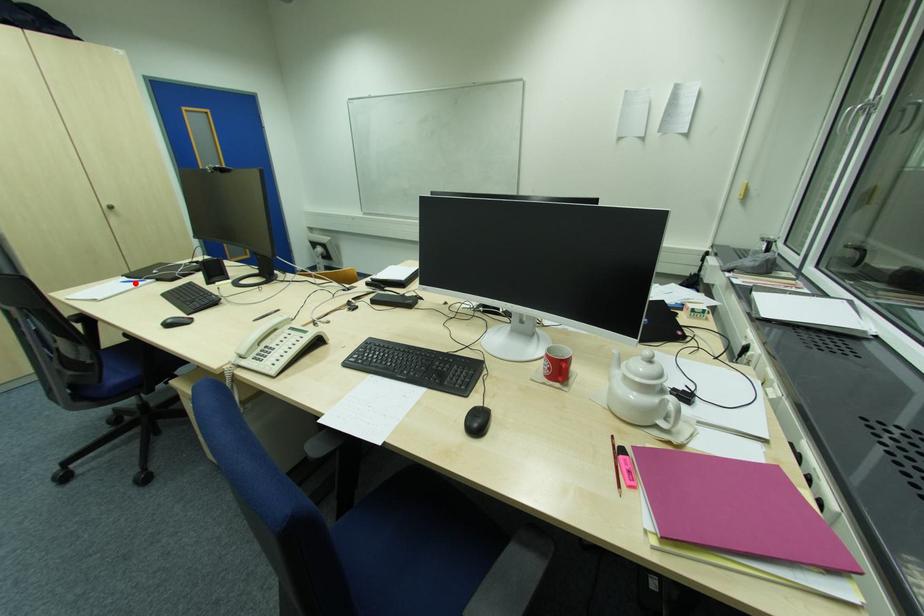
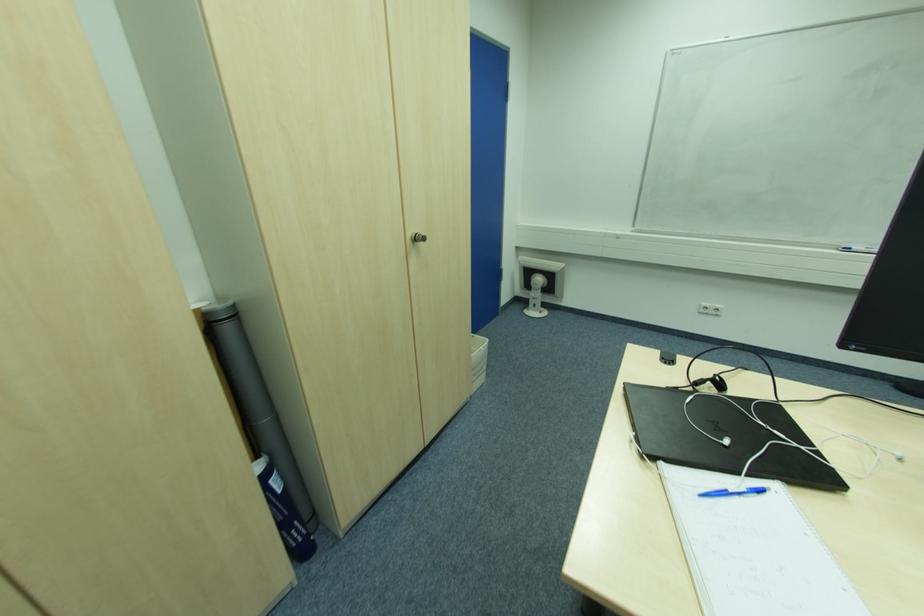
Where in the second image is the point corresponding to the highlighted location from the first image?

(727, 493)